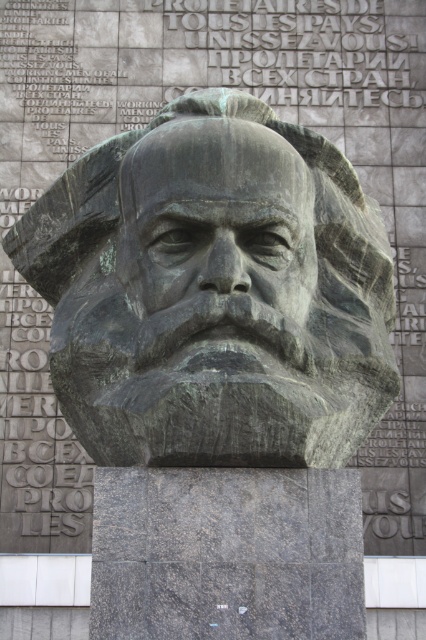
Is bronze statue at center in front of bronze statue head at center?

No, bronze statue at center is further to the viewer.

Which is more to the left, bronze statue at center or bronze statue head at center?

Positioned to the left is bronze statue at center.

Who is more forward, (204,388) or (140,262)?

Point (204,388) is in front.

Identify the location of bronze statue at center. (213, 291).

Is bronze statue at center below gray stone text at upper center?

Yes, bronze statue at center is below gray stone text at upper center.

Does bronze statue at center have a smaller size compared to gray stone text at upper center?

No, bronze statue at center is not smaller than gray stone text at upper center.

Who is more distant from viewer, (169,112) or (330,26)?

The point (330,26) is behind.

Where is `bronze statue at center`? The width and height of the screenshot is (426, 640). bronze statue at center is located at coordinates (213, 291).

Is bronze statue head at center shorter than gray stone text at upper center?

In fact, bronze statue head at center may be taller than gray stone text at upper center.

Is point (279, 209) more distant than point (327, 104)?

No, it is not.

Which is behind, point (176, 248) or point (336, 48)?

The point (336, 48) is behind.

Where is `bronze statue head at center`? bronze statue head at center is located at coordinates (216, 237).